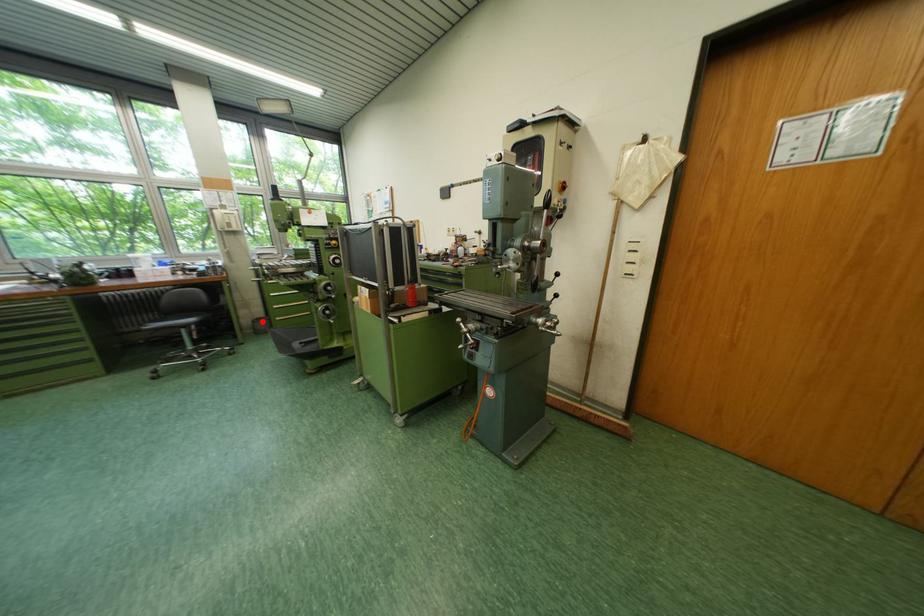
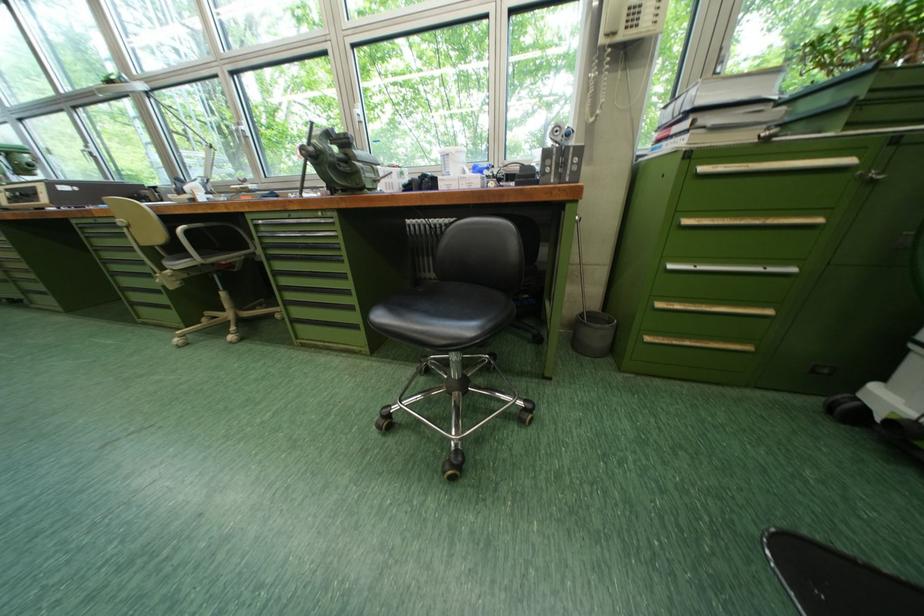
Question: I am providing you with two images of the same scene from different viewpoints. Image1 has a red point marked. In image2, the corresponding 3D location appears at what relative position? Reply with the corresponding letter.

Choices:
 (A) Closer
 (B) Farther

Answer: (A)